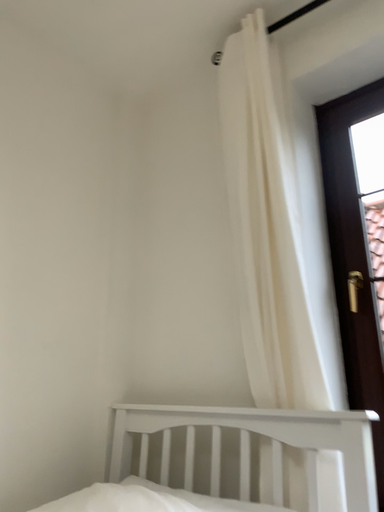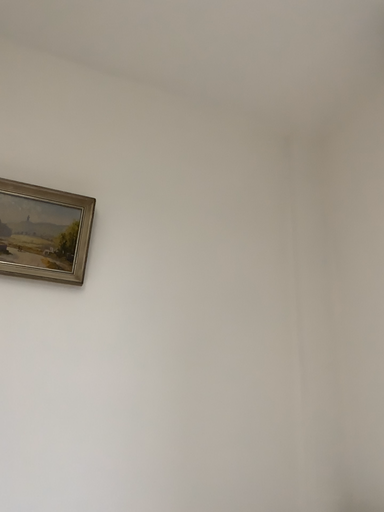
Question: Which way did the camera rotate in the video?

Choices:
 (A) rotated left
 (B) rotated right

Answer: (A)